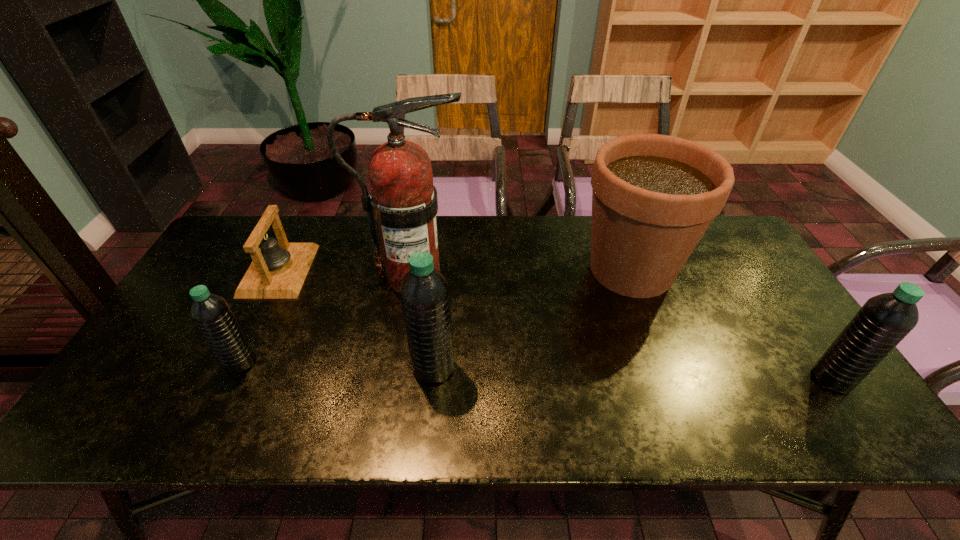
Select which water bottle is the second closest to the fifth object from left to right. Please provide its 2D coordinates. Your answer should be formatted as a tuple, i.e. [(x, y)], where the tuple contains the x and y coordinates of a point satisfying the conditions above.

[(424, 292)]

Locate an element on the screen. free point that satisfies the following two spatial constraints: 1. on the back side of the third shortest object; 2. at the nozzle of the tallest object is located at coordinates (761, 276).

Image resolution: width=960 pixels, height=540 pixels. I want to click on vacant point that satisfies the following two spatial constraints: 1. on the back side of the fifth object from left to right; 2. on the left side of the shortest water bottle, so click(285, 269).

Identify the location of free space that satisfies the following two spatial constraints: 1. on the front side of the shortest object; 2. on the right side of the fifth tallest object. This screenshot has width=960, height=540. (233, 362).

Locate an element on the screen. The image size is (960, 540). vacant space that satisfies the following two spatial constraints: 1. on the front side of the rightmost object; 2. on the left side of the bell is located at coordinates (226, 379).